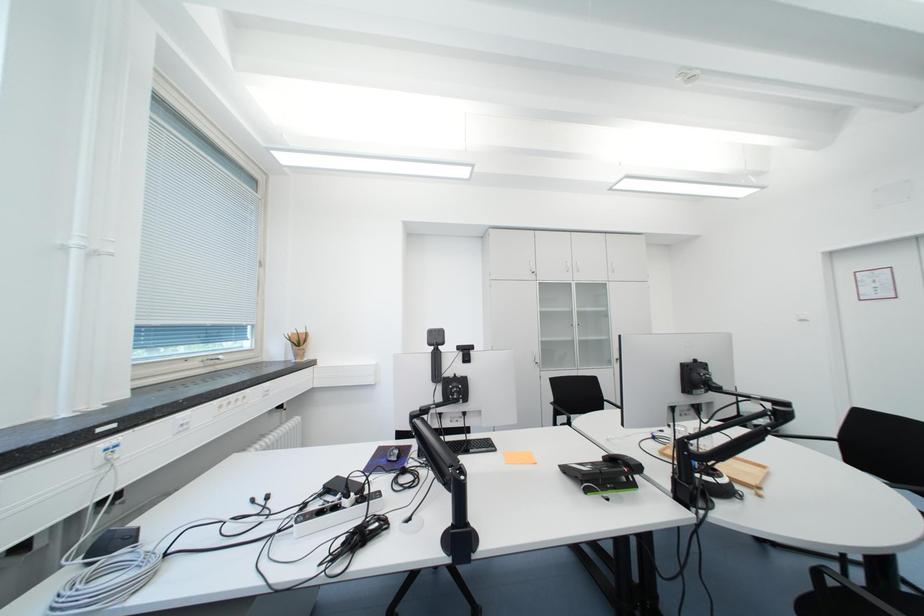
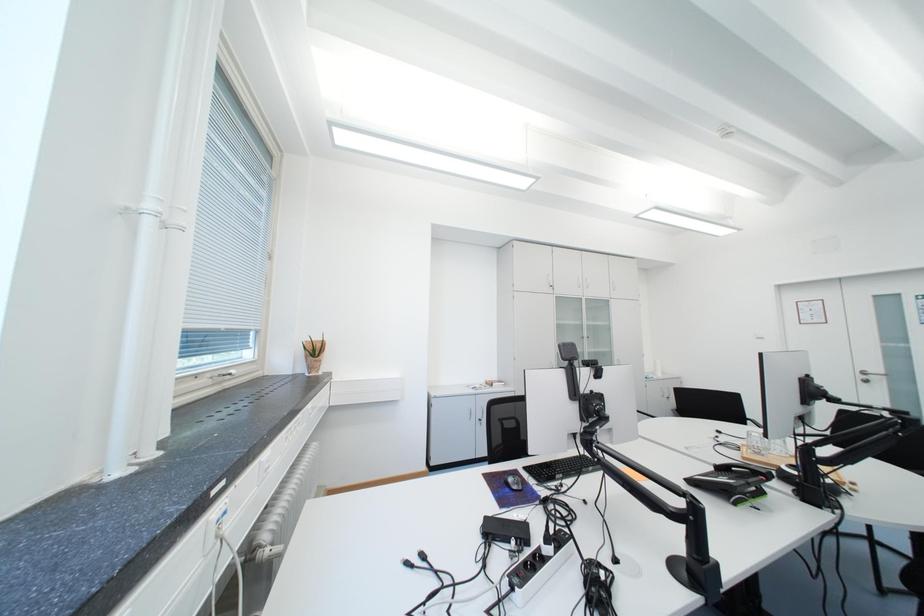
Question: The first image is from the beginning of the video and the second image is from the end. How did the camera likely rotate when shooting the video?

Choices:
 (A) Left
 (B) Right
 (C) Up
 (D) Down

Answer: (B)